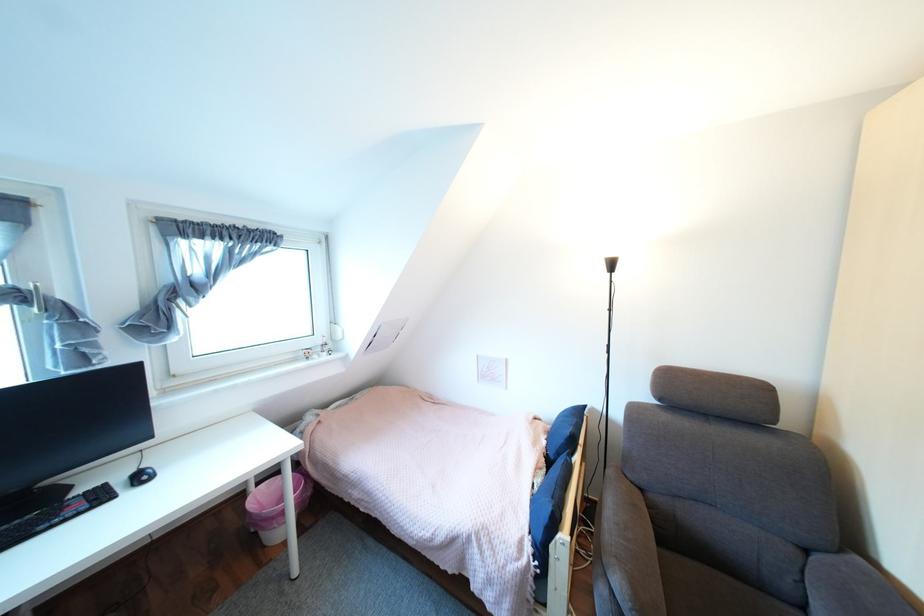
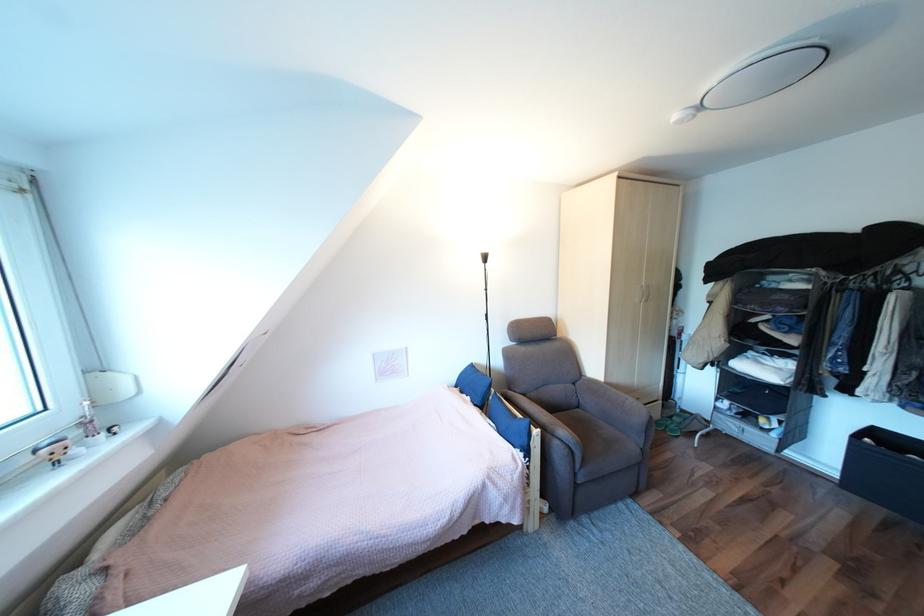
Question: The camera is either moving clockwise (left) or counter-clockwise (right) around the object. The first image is from the beginning of the video and the second image is from the end. Is the camera moving left or right when shooting the video?

Choices:
 (A) Left
 (B) Right

Answer: (A)